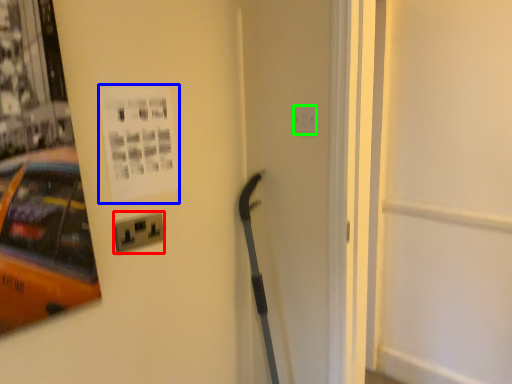
Question: Which object is the closest to the electric outlet (highlighted by a red box)? Choose among these: poster page (highlighted by a blue box) or electric outlet (highlighted by a green box).

Choices:
 (A) poster page
 (B) electric outlet

Answer: (A)